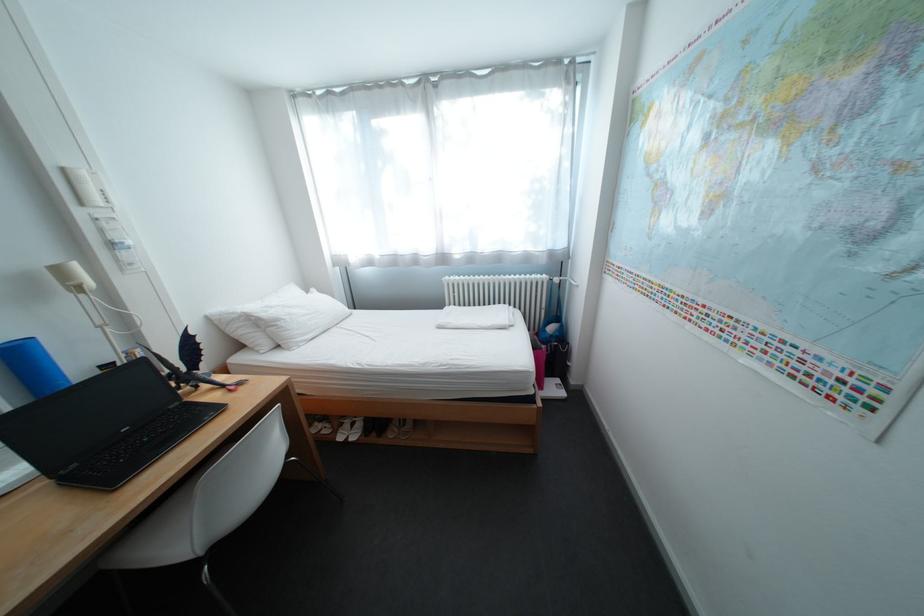
Locate an element on the screen. white pillow is located at coordinates (298, 317).